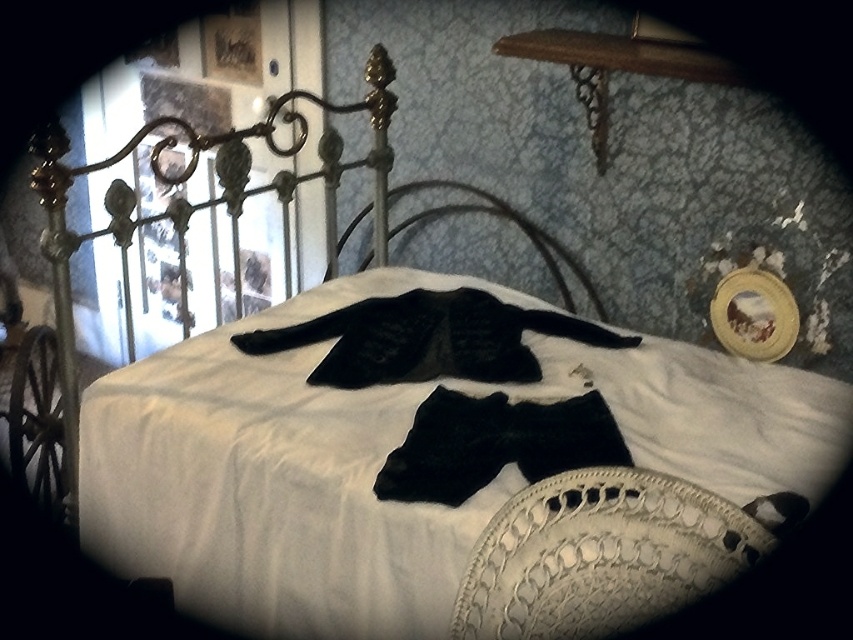
Does black velvet bow tie at center have a greater width compared to black matte iron bed at center?

In fact, black velvet bow tie at center might be narrower than black matte iron bed at center.

Is black velvet bow tie at center to the right of black matte iron bed at center from the viewer's perspective?

Correct, you'll find black velvet bow tie at center to the right of black matte iron bed at center.

Does point (494, 410) come closer to viewer compared to point (589, 298)?

Yes.

Locate an element on the screen. The height and width of the screenshot is (640, 853). black velvet bow tie at center is located at coordinates (495, 444).

Between white lace pillow at lower right and black velvet bow tie at center, which one is positioned higher?

black velvet bow tie at center is higher up.

Is point (668, 572) behind point (457, 465)?

That is False.

Which is in front, point (508, 556) or point (457, 481)?

Point (508, 556) is more forward.

This screenshot has width=853, height=640. I want to click on white lace pillow at lower right, so click(601, 556).

Is the position of black fuzzy coat at center less distant than that of black velvet bow tie at center?

That is False.

Image resolution: width=853 pixels, height=640 pixels. What are the coordinates of `black fuzzy coat at center` in the screenshot? It's located at (427, 339).

Is point (566, 323) farther from viewer compared to point (424, 460)?

That is True.

The height and width of the screenshot is (640, 853). Find the location of `black fuzzy coat at center`. black fuzzy coat at center is located at coordinates (427, 339).